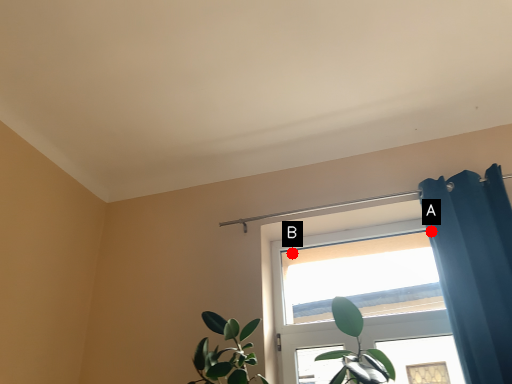
Question: Two points are circled on the image, labeled by A and B beside each circle. Among these points, which one is nearest to the camera?

Choices:
 (A) A is closer
 (B) B is closer

Answer: (A)